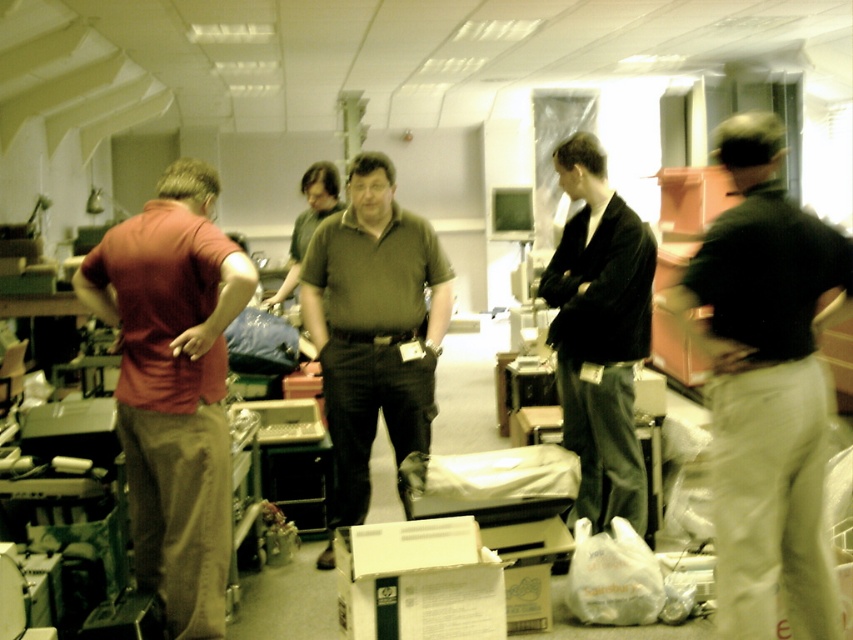
Question: Can you confirm if black cotton shirt at right is smaller than dark gray suit at center?

Choices:
 (A) yes
 (B) no

Answer: (A)

Question: Among these points, which one is nearest to the camera?

Choices:
 (A) (380, 384)
 (B) (430, 540)
 (C) (819, 444)

Answer: (C)

Question: Does green matte shirt at center have a lesser width compared to white cardboard box at lower center?

Choices:
 (A) yes
 (B) no

Answer: (B)

Question: Is black cotton shirt at right bigger than white cardboard box at lower center?

Choices:
 (A) yes
 (B) no

Answer: (A)

Question: Which point is closer to the camera?

Choices:
 (A) (682, 301)
 (B) (335, 429)
 (C) (177, 268)
 (D) (354, 538)

Answer: (A)

Question: Which of these objects is positioned farthest from the dark gray suit at center?

Choices:
 (A) black cotton shirt at right
 (B) white cardboard box at lower center
 (C) matte red shirt at left
 (D) green matte shirt at center

Answer: (C)